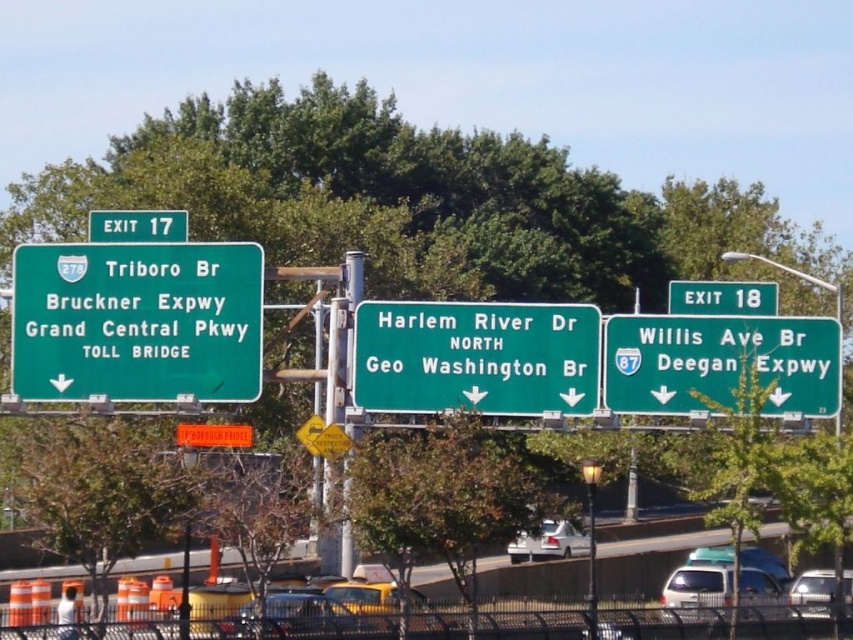
Can you confirm if green metallic sign at left is shorter than green matte sign at upper left?

Incorrect, green metallic sign at left's height does not fall short of green matte sign at upper left's.

Does point (209, 268) come farther from viewer compared to point (158, 236)?

No, (209, 268) is in front of (158, 236).

The width and height of the screenshot is (853, 640). What do you see at coordinates (136, 321) in the screenshot? I see `green metallic sign at left` at bounding box center [136, 321].

The image size is (853, 640). Identify the location of green metallic sign at left. [136, 321].

Does green metallic sign at left have a smaller size compared to green matte sign at right?

Incorrect, green metallic sign at left is not smaller in size than green matte sign at right.

Is point (96, 307) less distant than point (807, 384)?

No, (96, 307) is behind (807, 384).

Who is more forward, [26,288] or [614,344]?

Point [614,344] is in front.

Where is `green metallic sign at left`? The height and width of the screenshot is (640, 853). green metallic sign at left is located at coordinates (136, 321).

What do you see at coordinates (722, 298) in the screenshot? I see `green metallic sign at right` at bounding box center [722, 298].

Which is more to the left, green metallic sign at right or green matte sign at upper left?

green matte sign at upper left is more to the left.

Which is behind, point (740, 292) or point (115, 212)?

Point (740, 292)

At what (x,y) coordinates should I click in order to perform the action: click on green metallic sign at right. Please return your answer as a coordinate pair (x, y). Image resolution: width=853 pixels, height=640 pixels. Looking at the image, I should click on (722, 298).